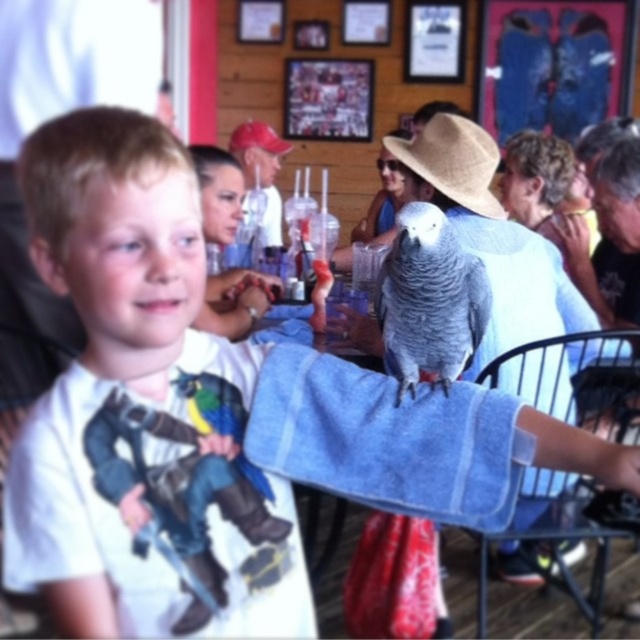
You are standing in the cafe and want to reach both the point at coordinates (452, 157) and the point at coordinates (248, 140). Which point should you approach first to reach the one closer to you?

You should approach point (452, 157) first because it is closer to you than point (248, 140).